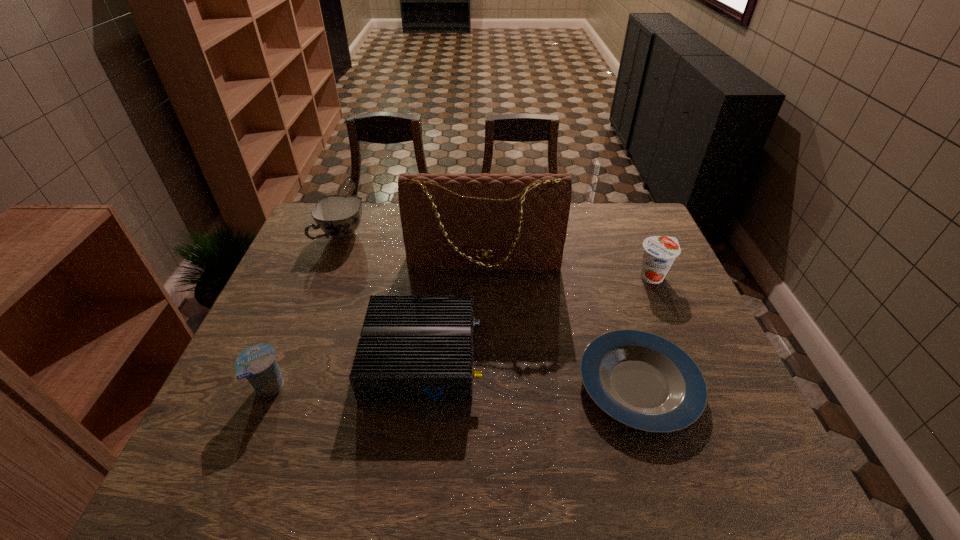
Locate an element on the screen. The width and height of the screenshot is (960, 540). blank space located on the back panel of the router is located at coordinates (538, 357).

Locate an element on the screen. vacant space located on the back of the shortest object is located at coordinates (607, 283).

Find the location of `object located in the far edge section of the desktop`. object located in the far edge section of the desktop is located at coordinates (339, 216).

Where is `chinaware located at the left edge`? The height and width of the screenshot is (540, 960). chinaware located at the left edge is located at coordinates (339, 216).

Locate an element on the screen. This screenshot has height=540, width=960. yogurt that is at the left edge is located at coordinates (257, 363).

The width and height of the screenshot is (960, 540). I want to click on yogurt that is at the right edge, so click(659, 253).

The width and height of the screenshot is (960, 540). I want to click on plate at the right edge, so click(x=644, y=381).

Identify the location of object situated at the far left corner. (339, 216).

The width and height of the screenshot is (960, 540). What are the coordinates of `vacant space at the near edge` in the screenshot? It's located at (612, 482).

This screenshot has height=540, width=960. Identify the location of vacant space at the left edge of the desktop. (294, 363).